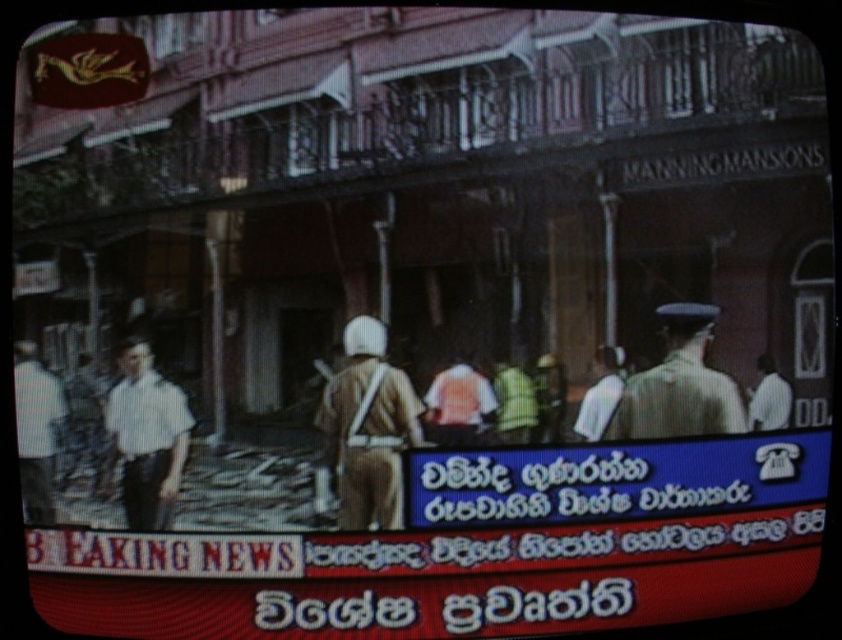
You are a news analyst reviewing a broadcast image. You notice a point marked at coordinates (x=368, y=428). Based on the scene description, what object is located at this point?

The point at coordinates (x=368, y=428) indicates the location of the brown fabric uniform at center.

You are standing at the point marked as point (710, 305) in the image. A friend is located at your current position and wants to know how far they are from you. What do you tell them?

The point (710, 305) and the viewer are 4.20 feet apart from each other, so you would tell your friend that they are 4.20 feet away from you.

You are a news anchor observing the scene on your screen. You notice two individuals in the foreground. The first is wearing a light brown uniform at center, and the second is wearing a white shirt at left. From your vantage point, which individual is positioned higher up in the frame?

The light brown uniform at center is located above the white shirt at left, so the individual in the light brown uniform at center is positioned higher up in the frame.